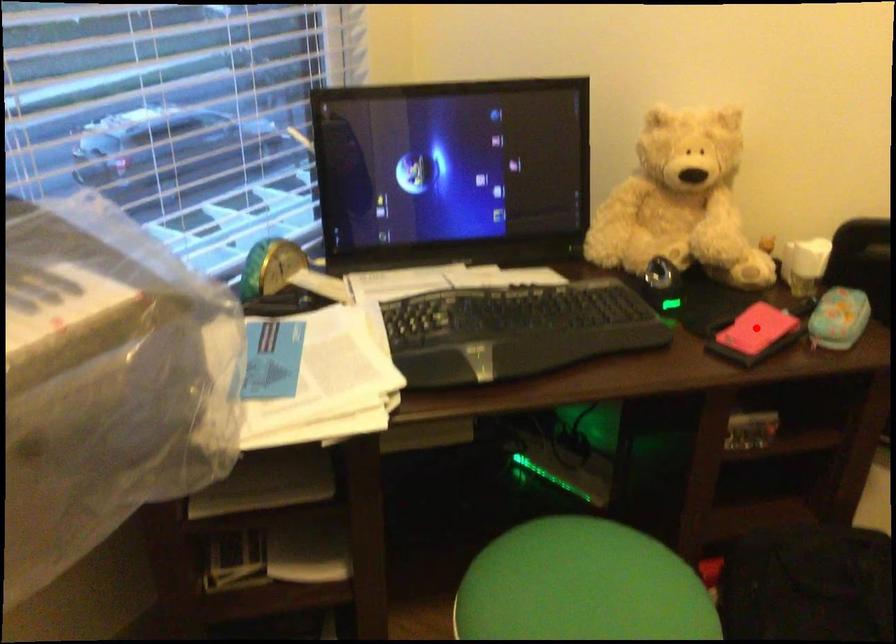
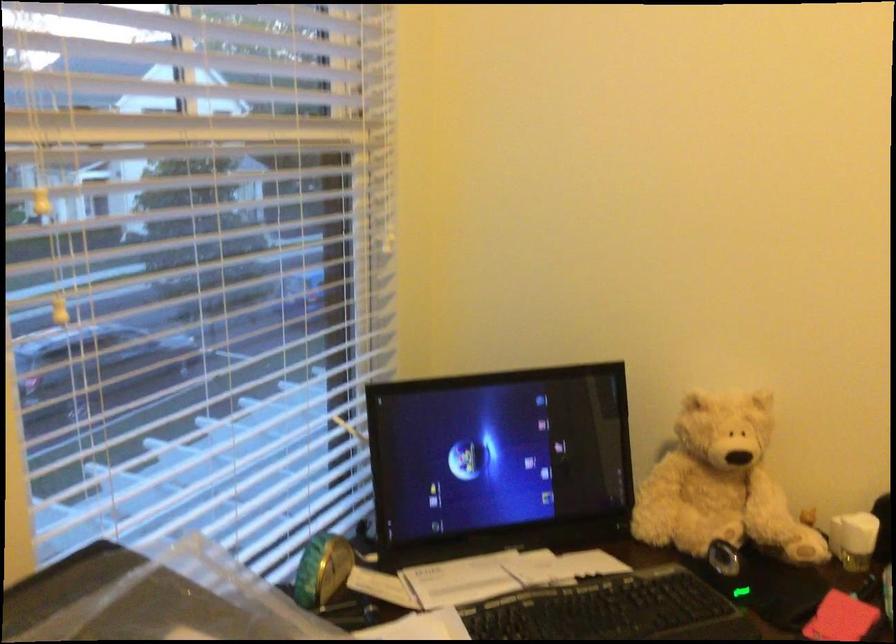
Locate, in the second image, the point that corresponds to the highlighted location in the first image.

(840, 618)